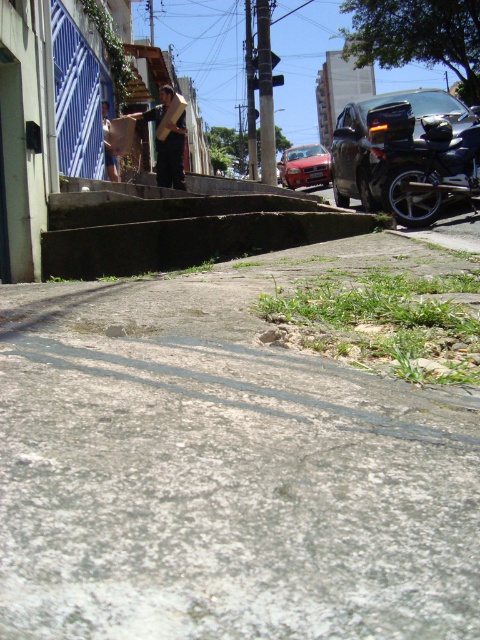
Can you confirm if brown concrete stairs at center is wider than brown leather jacket at upper center?

Indeed, brown concrete stairs at center has a greater width compared to brown leather jacket at upper center.

Does brown concrete stairs at center appear on the right side of brown leather jacket at upper center?

Correct, you'll find brown concrete stairs at center to the right of brown leather jacket at upper center.

The height and width of the screenshot is (640, 480). Describe the element at coordinates (180, 228) in the screenshot. I see `brown concrete stairs at center` at that location.

Identify the location of brown concrete stairs at center. (180, 228).

Does wooden skateboard at center have a smaller size compared to matte red car at center?

Indeed, wooden skateboard at center has a smaller size compared to matte red car at center.

Does wooden skateboard at center appear over matte red car at center?

No, wooden skateboard at center is not above matte red car at center.

Is point (159, 118) positioned before point (278, 164)?

Yes.

At what (x,y) coordinates should I click in order to perform the action: click on wooden skateboard at center. Please return your answer as a coordinate pair (x, y). Image resolution: width=480 pixels, height=640 pixels. Looking at the image, I should click on (171, 156).

Who is shorter, shiny black car at upper right or matte red car at center?

Answer: shiny black car at upper right

Does shiny black car at upper right lie in front of matte red car at center?

Yes, it is in front of matte red car at center.

Image resolution: width=480 pixels, height=640 pixels. What do you see at coordinates (370, 148) in the screenshot? I see `shiny black car at upper right` at bounding box center [370, 148].

The width and height of the screenshot is (480, 640). What are the coordinates of `shiny black car at upper right` in the screenshot? It's located at (370, 148).